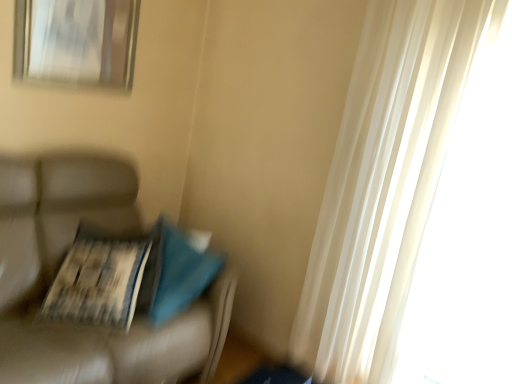
Question: Does leather couch at left appear on the left side of printed paper magazine at left?

Choices:
 (A) no
 (B) yes

Answer: (B)

Question: Can you confirm if leather couch at left is positioned to the right of printed paper magazine at left?

Choices:
 (A) no
 (B) yes

Answer: (A)

Question: From the image's perspective, is leather couch at left below printed paper magazine at left?

Choices:
 (A) yes
 (B) no

Answer: (A)

Question: Considering the relative sizes of leather couch at left and printed paper magazine at left in the image provided, is leather couch at left bigger than printed paper magazine at left?

Choices:
 (A) yes
 (B) no

Answer: (A)

Question: From a real-world perspective, is leather couch at left positioned under printed paper magazine at left based on gravity?

Choices:
 (A) no
 (B) yes

Answer: (B)

Question: Is leather couch at left smaller than printed paper magazine at left?

Choices:
 (A) yes
 (B) no

Answer: (B)

Question: Is metallic silver picture frame at upper left bigger than leather couch at left?

Choices:
 (A) yes
 (B) no

Answer: (B)

Question: Considering the relative sizes of metallic silver picture frame at upper left and leather couch at left in the image provided, is metallic silver picture frame at upper left thinner than leather couch at left?

Choices:
 (A) yes
 (B) no

Answer: (A)

Question: From the image's perspective, is metallic silver picture frame at upper left located beneath leather couch at left?

Choices:
 (A) yes
 (B) no

Answer: (B)

Question: Is metallic silver picture frame at upper left placed right next to leather couch at left?

Choices:
 (A) no
 (B) yes

Answer: (A)

Question: Could leather couch at left be considered to be inside metallic silver picture frame at upper left?

Choices:
 (A) no
 (B) yes

Answer: (A)

Question: Would you say metallic silver picture frame at upper left is outside leather couch at left?

Choices:
 (A) no
 (B) yes

Answer: (B)

Question: Is leather couch at left inside printed paper magazine at left?

Choices:
 (A) yes
 (B) no

Answer: (B)